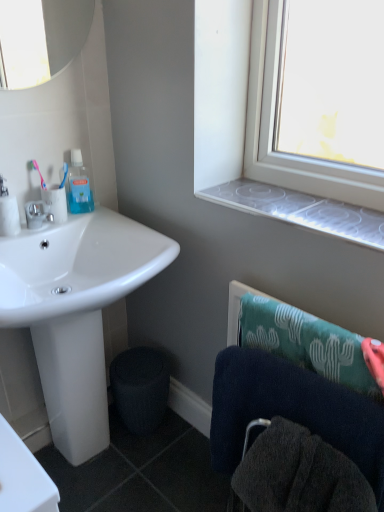
Question: Is transparent plastic window sill at upper right aimed at white glossy sink at lower left?

Choices:
 (A) yes
 (B) no

Answer: (B)

Question: Considering the relative sizes of transparent plastic window sill at upper right and white glossy sink at lower left in the image provided, is transparent plastic window sill at upper right smaller than white glossy sink at lower left?

Choices:
 (A) yes
 (B) no

Answer: (A)

Question: From a real-world perspective, is transparent plastic window sill at upper right located beneath white glossy sink at lower left?

Choices:
 (A) yes
 (B) no

Answer: (B)

Question: Is white glossy sink at lower left located within transparent plastic window sill at upper right?

Choices:
 (A) no
 (B) yes

Answer: (A)

Question: From a real-world perspective, is transparent plastic window sill at upper right on white glossy sink at lower left?

Choices:
 (A) yes
 (B) no

Answer: (A)

Question: Is transparent plastic window sill at upper right directly adjacent to white glossy sink at lower left?

Choices:
 (A) no
 (B) yes

Answer: (A)

Question: Is the position of matte silver faucet at left more distant than that of white matte toilet paper at left, acting as the 1th toilet paper starting from the left?

Choices:
 (A) no
 (B) yes

Answer: (B)

Question: Can you confirm if matte silver faucet at left is wider than white matte toilet paper at left, the 2th toilet paper from the right?

Choices:
 (A) no
 (B) yes

Answer: (B)

Question: From the image's perspective, is matte silver faucet at left located above white matte toilet paper at left, acting as the 1th toilet paper starting from the left?

Choices:
 (A) yes
 (B) no

Answer: (B)

Question: Is matte silver faucet at left positioned far away from white matte toilet paper at left, acting as the 1th toilet paper starting from the left?

Choices:
 (A) yes
 (B) no

Answer: (B)

Question: Is matte silver faucet at left in contact with white matte toilet paper at left, acting as the 1th toilet paper starting from the left?

Choices:
 (A) no
 (B) yes

Answer: (B)

Question: From the image's perspective, is matte silver faucet at left under white matte toilet paper at left, acting as the 1th toilet paper starting from the left?

Choices:
 (A) yes
 (B) no

Answer: (A)

Question: Can you confirm if pink plastic toothbrush at upper left is shorter than transparent plastic mouthwash at upper left?

Choices:
 (A) no
 (B) yes

Answer: (B)